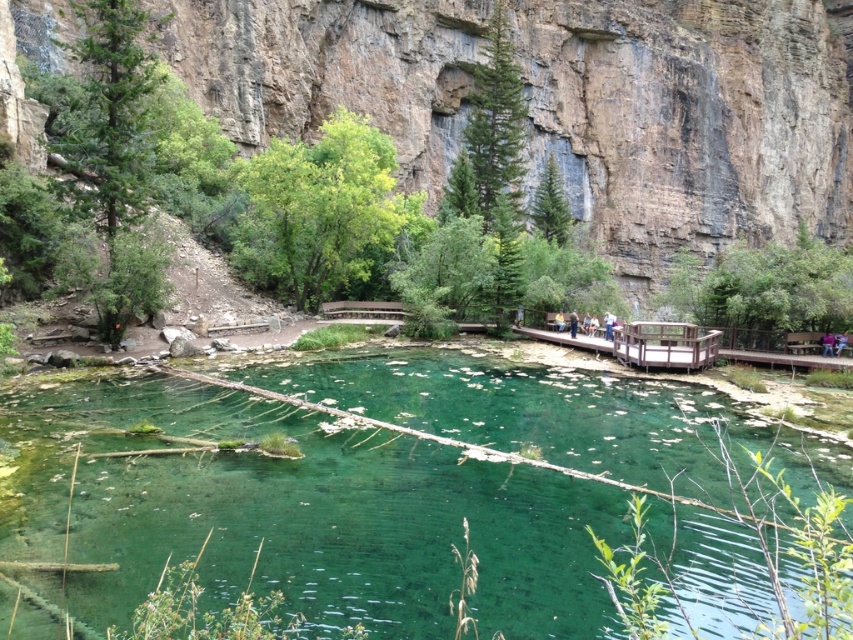
You are standing at the edge of the pool and want to take a photo of both the green translucent water at center and the brown rock canyon at center. Which object will appear larger in your photo?

The green translucent water at center will appear larger in the photo because it is closer to the viewer than the brown rock canyon at center.

What are the coordinates of the green translucent water at center?

The green translucent water at center is located at point (302, 513).